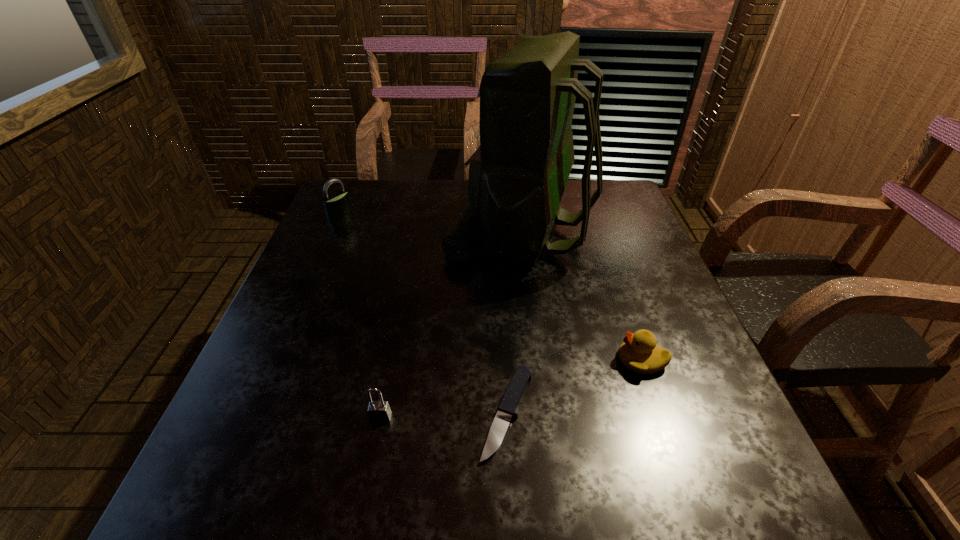
Where is `backpack that is at the right edge`? backpack that is at the right edge is located at coordinates (517, 176).

In order to click on duckling present at the right edge in this screenshot , I will do tap(639, 352).

Identify the location of object located in the far left corner section of the desktop. The height and width of the screenshot is (540, 960). (336, 206).

Where is `object that is at the far right corner`? The image size is (960, 540). object that is at the far right corner is located at coordinates (517, 176).

The height and width of the screenshot is (540, 960). In the image, there is a desktop. Find the location of `free space at the near edge`. free space at the near edge is located at coordinates (382, 510).

Locate an element on the screen. Image resolution: width=960 pixels, height=540 pixels. vacant space at the left edge of the desktop is located at coordinates (349, 312).

Locate an element on the screen. free region at the right edge of the desktop is located at coordinates (621, 265).

The width and height of the screenshot is (960, 540). In order to click on vacant area at the far left corner of the desktop in this screenshot , I will do `click(347, 189)`.

Locate an element on the screen. The height and width of the screenshot is (540, 960). free point at the far right corner is located at coordinates point(612,194).

The height and width of the screenshot is (540, 960). Find the location of `vacant point located between the tallest object and the left padlock`. vacant point located between the tallest object and the left padlock is located at coordinates (430, 224).